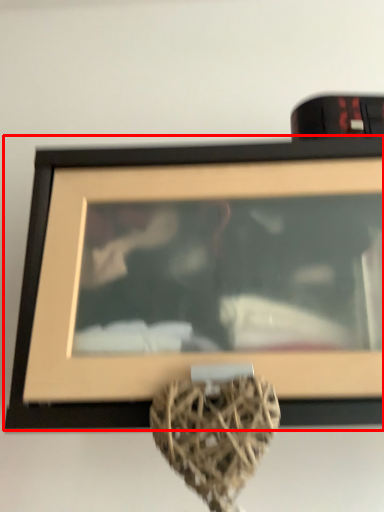
Question: Considering the relative positions of picture frame (annotated by the red box) and vase in the image provided, where is picture frame (annotated by the red box) located with respect to the staircase?

Choices:
 (A) left
 (B) right

Answer: (B)